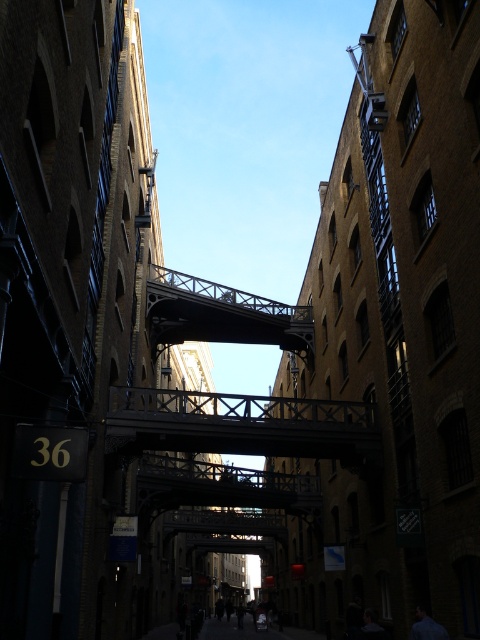
You are a delivery person trying to navigate through the narrow alley. You need to pass under the dark gray metal pedestrian bridge at center. Is there enough space for you to walk comfortably under the wooden bridge at center?

The wooden bridge at center is located below the dark gray metal pedestrian bridge at center, so there is sufficient space between them for you to walk comfortably underneath.

You are standing at the entrance of the alley and notice a point marked at coordinates (240, 424). What object does this point represent?

The point at coordinates (240, 424) corresponds to the wooden bridge at center.

You are a delivery person carrying a package and need to cross the alley. There are two bridges here. The wooden bridge at center and the dark gray metal pedestrian bridge at center. Which bridge is farther from the other bridge?

The wooden bridge at center is 27.37 meters away from the dark gray metal pedestrian bridge at center, so the wooden bridge at center is farther from the dark gray metal pedestrian bridge at center.